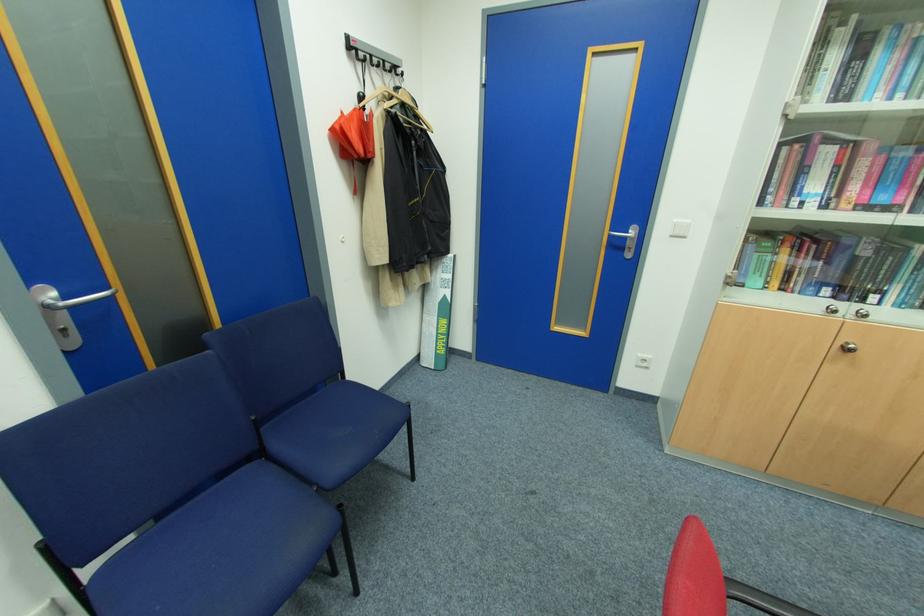
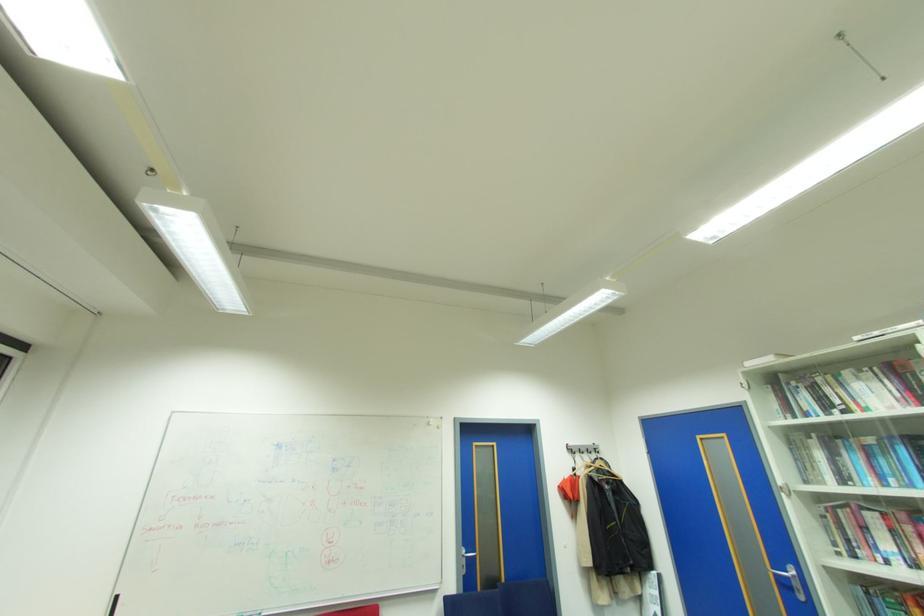
The point at (628, 238) is marked in the first image. Where is the corresponding point in the second image?

(791, 578)